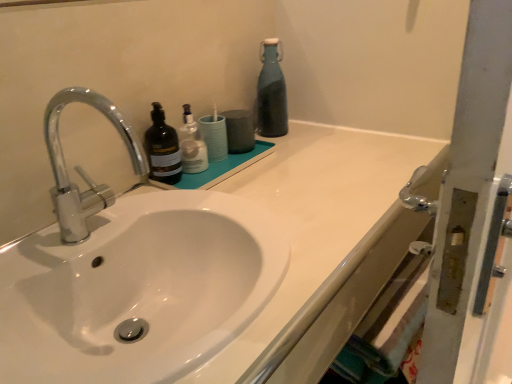
Question: Is polished chrome faucet at left wider than matte black bottle at center, the 1th bottle when ordered from left to right?

Choices:
 (A) yes
 (B) no

Answer: (A)

Question: Is polished chrome faucet at left shorter than matte black bottle at center, marked as the third bottle in a right-to-left arrangement?

Choices:
 (A) no
 (B) yes

Answer: (A)

Question: From a real-world perspective, is polished chrome faucet at left under matte black bottle at center, which appears as the 3th bottle when viewed from the back?

Choices:
 (A) yes
 (B) no

Answer: (B)

Question: Does polished chrome faucet at left appear on the left side of matte black bottle at center, which appears as the first bottle when viewed from the front?

Choices:
 (A) yes
 (B) no

Answer: (A)

Question: From the image's perspective, is polished chrome faucet at left located above matte black bottle at center, marked as the third bottle in a right-to-left arrangement?

Choices:
 (A) yes
 (B) no

Answer: (B)

Question: Can matte black bottle at center, which appears as the 3th bottle when viewed from the back, be found inside polished chrome faucet at left?

Choices:
 (A) yes
 (B) no

Answer: (B)

Question: Is white glossy sink at center at the right side of polished chrome faucet at left?

Choices:
 (A) yes
 (B) no

Answer: (A)

Question: From the image's perspective, is white glossy sink at center on polished chrome faucet at left?

Choices:
 (A) yes
 (B) no

Answer: (B)

Question: Would you say polished chrome faucet at left is part of white glossy sink at center's contents?

Choices:
 (A) yes
 (B) no

Answer: (B)

Question: Can you confirm if white glossy sink at center is smaller than polished chrome faucet at left?

Choices:
 (A) yes
 (B) no

Answer: (B)

Question: Does white glossy sink at center have a greater width compared to polished chrome faucet at left?

Choices:
 (A) yes
 (B) no

Answer: (A)

Question: Does white glossy sink at center have a lesser width compared to polished chrome faucet at left?

Choices:
 (A) no
 (B) yes

Answer: (A)

Question: Does teal glass bottle at upper right, which is the 3th bottle from front to back, appear on the left side of white glossy sink at center?

Choices:
 (A) no
 (B) yes

Answer: (A)